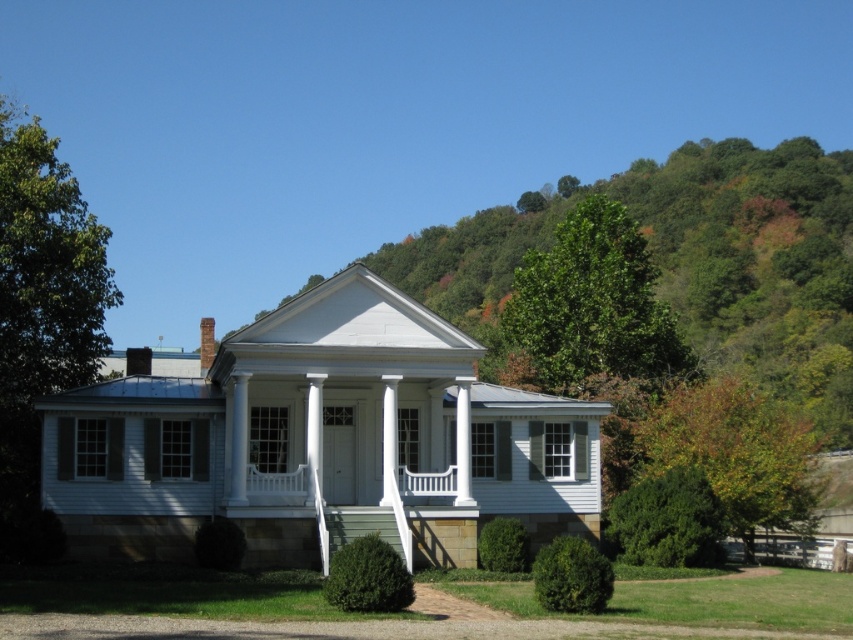
You are standing in front of the house and want to know which green area is higher up in the image. Which one is higher between the green leafy hillside at upper center and the green leafy tree at right?

The green leafy hillside at upper center is positioned over the green leafy tree at right, so it is higher up in the image.

You are standing in front of the two green leafy trees shown in the image. Which tree would cast a longer shadow at noon, the green leafy tree at upper center or the green leafy tree at right?

The green leafy tree at upper center is much taller than the green leafy tree at right, so it would cast a longer shadow at noon.

You are standing in front of the house and want to know which of the two green elements, the green leafy hillside at upper center or the green leafy tree at right, is larger in size. Can you determine this based on the scene?

The green leafy hillside at upper center is bigger than the green leafy tree at right.